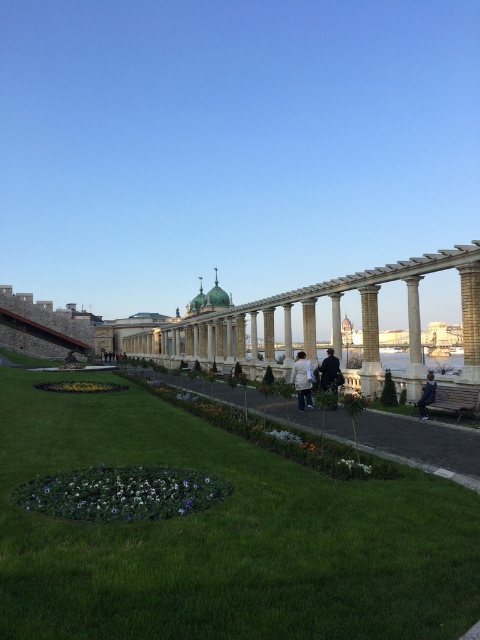
Question: In this image, where is dark blue jacket at center located relative to denim jacket at lower right?

Choices:
 (A) below
 (B) above

Answer: (A)

Question: Can you confirm if brown wooden bench at lower right is positioned above dark blue jacket at center?

Choices:
 (A) yes
 (B) no

Answer: (B)

Question: Which point is closer to the camera?

Choices:
 (A) white fabric jacket at center
 (B) green grass at center
 (C) denim jacket at lower right
 (D) brown wooden bench at lower right

Answer: (B)

Question: Can you confirm if green grass at center is bigger than dark blue jacket at center?

Choices:
 (A) yes
 (B) no

Answer: (A)

Question: Which point is closer to the camera?

Choices:
 (A) (420, 413)
 (B) (303, 390)

Answer: (A)

Question: Which object is closer to the camera taking this photo?

Choices:
 (A) dark blue jacket at center
 (B) green grass at center
 (C) white fabric jacket at center

Answer: (B)